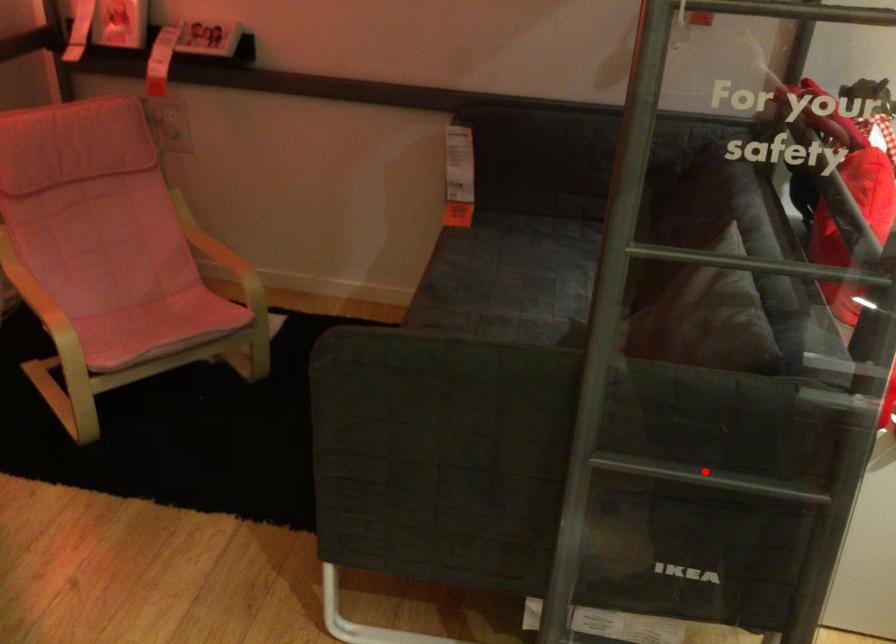
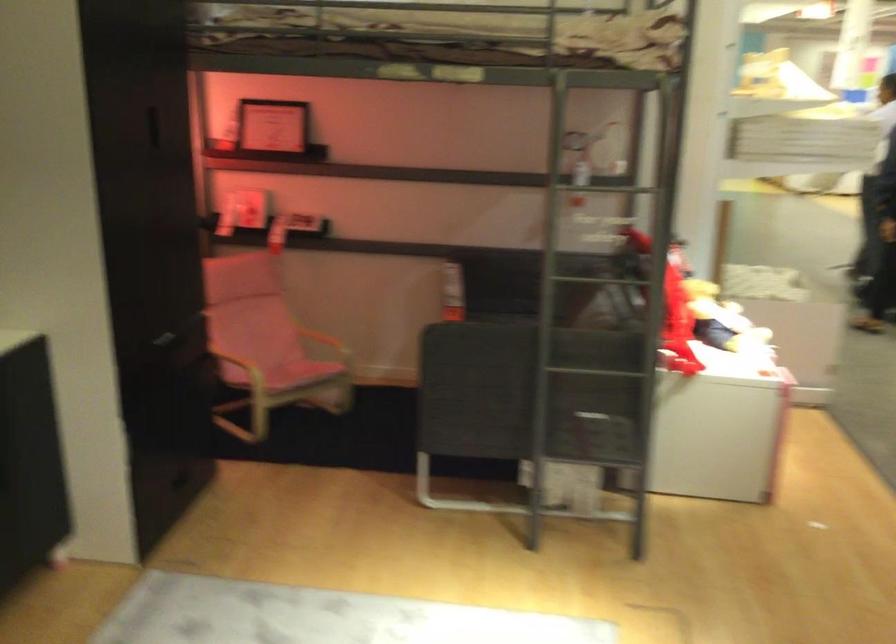
Question: I am providing you with two images of the same scene from different viewpoints. A red point is shown in image1. For the corresponding object point in image2, is it positioned nearer or farther from the camera?

Choices:
 (A) Nearer
 (B) Farther

Answer: (B)